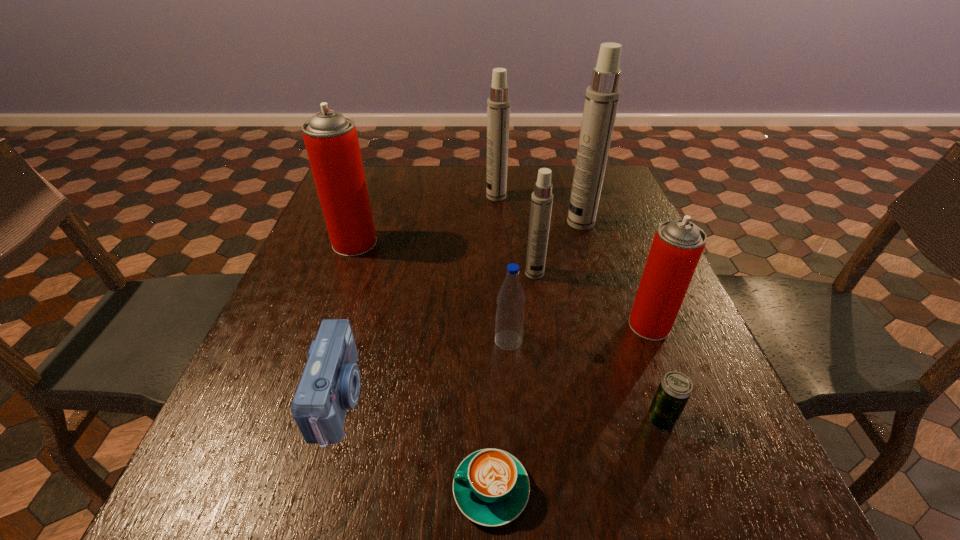
The width and height of the screenshot is (960, 540). Find the location of `free space between the turquoise cappuccino and the second white aerosol can from right to left`. free space between the turquoise cappuccino and the second white aerosol can from right to left is located at coordinates (513, 382).

You are a GUI agent. You are given a task and a screenshot of the screen. Output one action in this format:
    pyautogui.click(x=<x>, y=<y>)
    Task: Click on the free spot between the farthest aerosol can and the left red aerosol can
    The height and width of the screenshot is (540, 960).
    Given the screenshot: What is the action you would take?
    pyautogui.click(x=425, y=220)

In order to click on vacant area between the turquoise cappuccino and the second white aerosol can from right to left in this screenshot , I will do `click(513, 382)`.

Where is `unoccupied area between the water bottle and the shortest object`? This screenshot has height=540, width=960. unoccupied area between the water bottle and the shortest object is located at coordinates (500, 415).

Find the location of a particular element. The width and height of the screenshot is (960, 540). free spot between the farthest aerosol can and the leftmost aerosol can is located at coordinates (425, 220).

This screenshot has width=960, height=540. Find the location of `unoccupied position between the nearest aerosol can and the smallest white aerosol can`. unoccupied position between the nearest aerosol can and the smallest white aerosol can is located at coordinates (592, 299).

Image resolution: width=960 pixels, height=540 pixels. I want to click on vacant region between the camera and the cappuccino, so click(x=415, y=444).

Where is `vacant area that lies between the blue water bottle and the camera`? This screenshot has width=960, height=540. vacant area that lies between the blue water bottle and the camera is located at coordinates (424, 369).

In order to click on object that can be found as the eighth closest to the beer can in this screenshot , I will do `click(498, 104)`.

Where is `object that is the fifth nearest to the fourth aerosol can from right to left`? The width and height of the screenshot is (960, 540). object that is the fifth nearest to the fourth aerosol can from right to left is located at coordinates (677, 246).